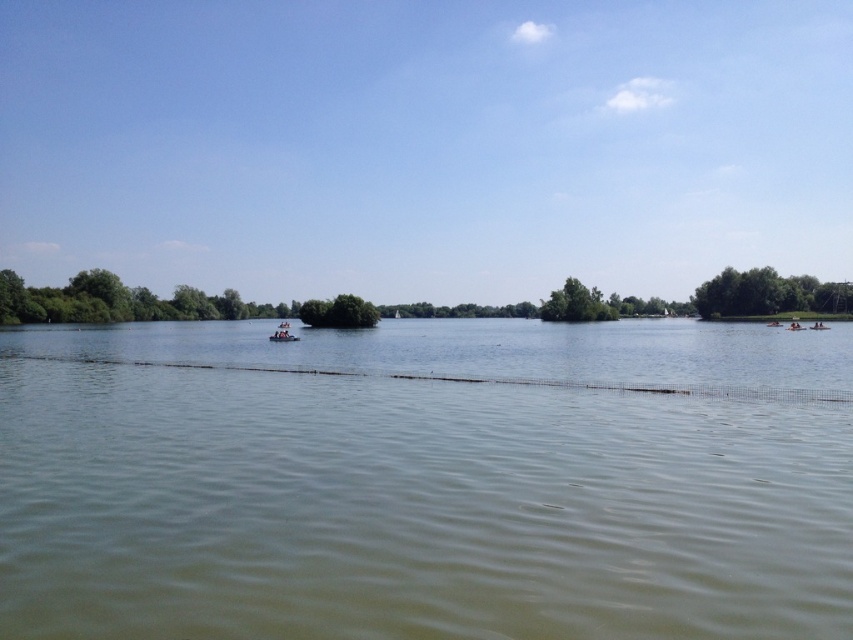
Is green murky water at center positioned in front of wooden raft at center?

Yes, it is.

Does green murky water at center have a lesser width compared to wooden raft at center?

No, green murky water at center is not thinner than wooden raft at center.

Does point (440, 428) lie behind point (292, 337)?

That is False.

Locate an element on the screen. green murky water at center is located at coordinates (425, 481).

Between point (787, 298) and point (276, 333), which one is positioned behind?

The point (787, 298) is more distant.

Where is `green leafy trees at right`? This screenshot has width=853, height=640. green leafy trees at right is located at coordinates (769, 294).

Who is more forward, (764, 292) or (283, 340)?

Point (283, 340) is in front.

Identify the location of green leafy trees at right. This screenshot has width=853, height=640. (769, 294).

Is green leafy trees at right shorter than green leafy tree at center?

No, green leafy trees at right is not shorter than green leafy tree at center.

Can you confirm if green leafy trees at right is positioned below green leafy tree at center?

Incorrect, green leafy trees at right is not positioned below green leafy tree at center.

You are a GUI agent. You are given a task and a screenshot of the screen. Output one action in this format:
    pyautogui.click(x=<x>, y=<y>)
    Task: Click on the green leafy trees at right
    This screenshot has width=853, height=640.
    Given the screenshot: What is the action you would take?
    pyautogui.click(x=769, y=294)